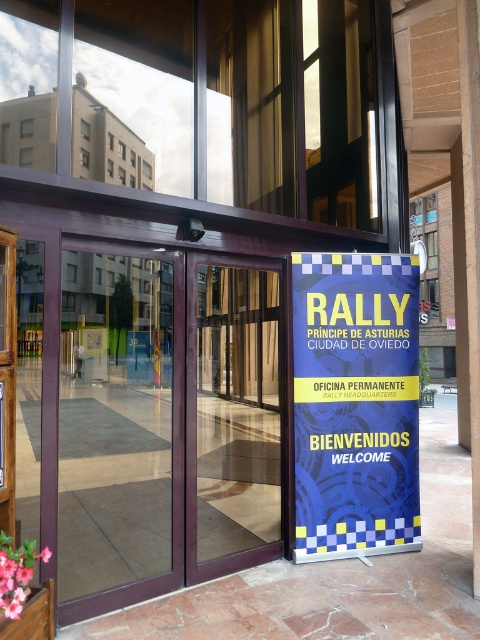
Describe the element at coordinates (120, 426) in the screenshot. I see `transparent glass door at center` at that location.

Locate an element on the screen. The image size is (480, 640). transparent glass door at center is located at coordinates (120, 426).

Where is `transparent glass door at center`? Image resolution: width=480 pixels, height=640 pixels. transparent glass door at center is located at coordinates (120, 426).

Does blue/yellow checkered banner at right come in front of matte glass door at center?

No, it is not.

Can you confirm if blue/yellow checkered banner at right is smaller than matte glass door at center?

Yes, blue/yellow checkered banner at right is smaller than matte glass door at center.

Who is more forward, (375, 387) or (200, 378)?

Positioned in front is point (375, 387).

This screenshot has height=640, width=480. Identify the location of blue/yellow checkered banner at right. (356, 404).

Who is higher up, transparent glass door at center or matte glass door at center?

transparent glass door at center is higher up.

Who is more distant from viewer, (121, 424) or (266, 356)?

Point (266, 356)

Where is `transparent glass door at center`? transparent glass door at center is located at coordinates (120, 426).

What are the coordinates of `transparent glass door at center` in the screenshot? It's located at click(120, 426).